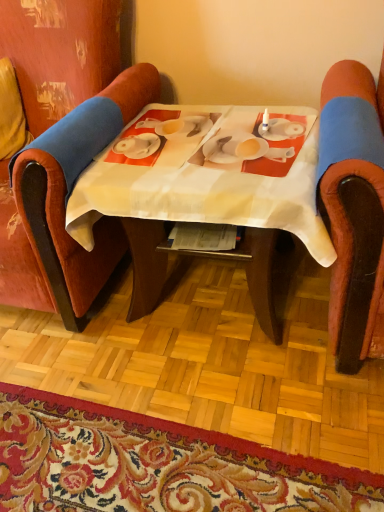
Question: Visually, is velvet red chair at left, acting as the second chair starting from the right, positioned to the left or to the right of white fabric table at center?

Choices:
 (A) left
 (B) right

Answer: (A)

Question: Do you think velvet red chair at left, which is the first chair in left-to-right order, is within white fabric table at center, or outside of it?

Choices:
 (A) inside
 (B) outside

Answer: (B)

Question: Considering the real-world distances, which object is closest to the white fabric table at center?

Choices:
 (A) carpet with floral pattern at lower center
 (B) velvet red chair at left, which is the first chair in left-to-right order
 (C) velvet-like orange chair at right, which is the first chair in right-to-left order

Answer: (C)

Question: Which is farther from the white fabric table at center?

Choices:
 (A) velvet red chair at left, which is the first chair in left-to-right order
 (B) velvet-like orange chair at right, which is the first chair in right-to-left order
 (C) carpet with floral pattern at lower center

Answer: (C)